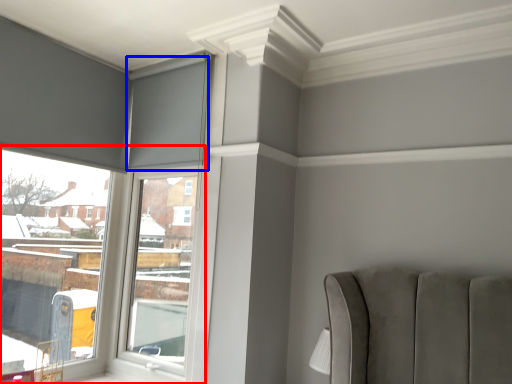
Question: Which object is closer to the camera taking this photo, window (highlighted by a red box) or curtain (highlighted by a blue box)?

Choices:
 (A) window
 (B) curtain

Answer: (A)